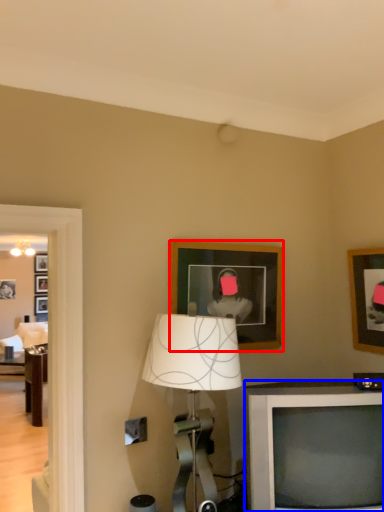
Question: Among these objects, which one is farthest to the camera, picture frame (highlighted by a red box) or television (highlighted by a blue box)?

Choices:
 (A) picture frame
 (B) television

Answer: (A)